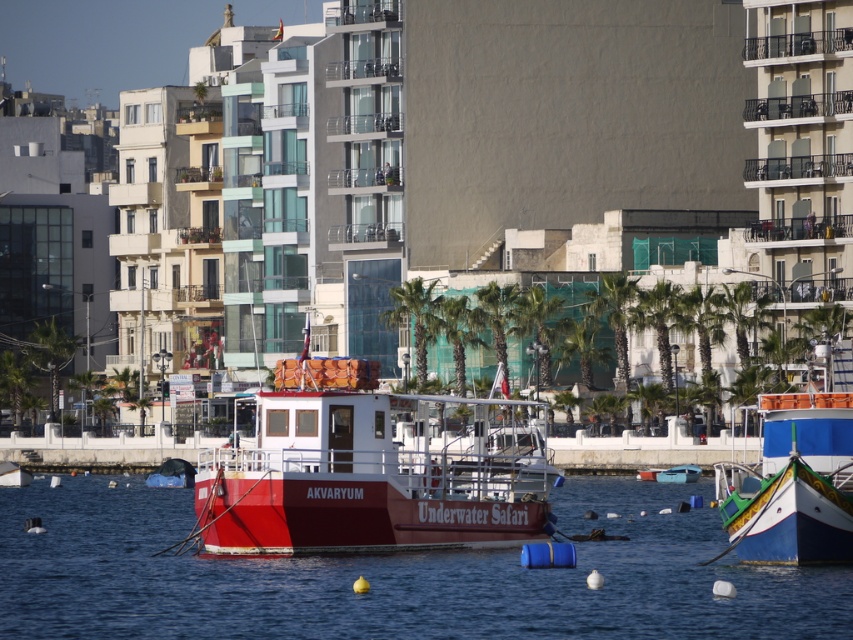
You are standing on the dock and want to take a photo of the blue painted wooden boat at lower right. To avoid the transparent blue water at center from appearing in the foreground, should you move forward or backward?

You should move forward because the transparent blue water at center is closer to the viewer than the blue painted wooden boat at lower right. Moving forward would reduce the distance between you and the boat, potentially allowing you to frame the shot so the water doesn not block the boat in the foreground.

You are standing at the waterfront and want to reach a specific point marked as point (206, 488). Given that the distance between you and this point is 312.93 feet, can you estimate how far you need to walk to reach it?

The distance between you and point (206, 488) is 312.93 feet, so you need to walk approximately 312.93 feet to reach it.